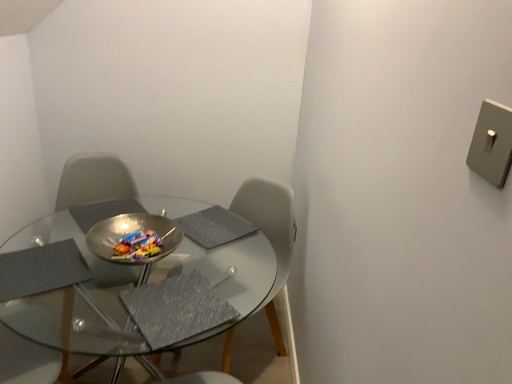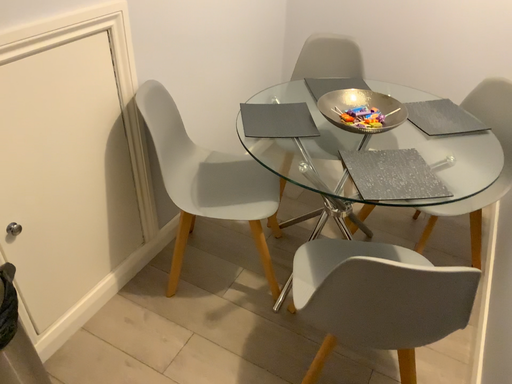
Question: Which way did the camera rotate in the video?

Choices:
 (A) rotated left
 (B) rotated right

Answer: (A)